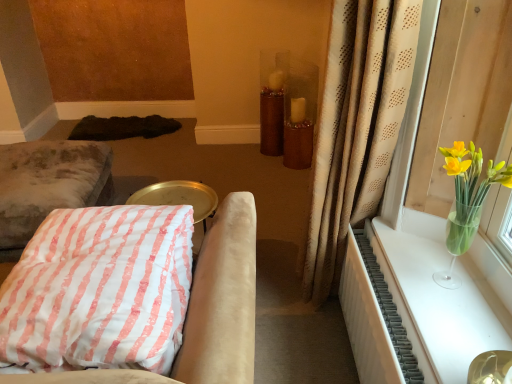
Question: Is white textured radiator at right bigger or smaller than brown glittery vase at center?

Choices:
 (A) small
 (B) big

Answer: (A)

Question: Is point (352, 269) positioned closer to the camera than point (273, 114)?

Choices:
 (A) closer
 (B) farther

Answer: (A)

Question: Which of these objects is positioned farthest from the translucent glass vase at upper right?

Choices:
 (A) velvet cushion at left, acting as the first furniture starting from the back
 (B) dark brown shaggy rug at lower left
 (C) beige dotted curtain at right
 (D) brown glittery vase at center
 (E) pink striped fabric cushion at lower left, which is counted as the second furniture, starting from the back

Answer: (B)

Question: Which is farther from the pink striped fabric cushion at lower left, the first furniture in the front-to-back sequence?

Choices:
 (A) dark brown shaggy rug at lower left
 (B) white textured radiator at right
 (C) velvet cushion at left, placed as the first furniture when sorted from left to right
 (D) translucent glass vase at upper right
 (E) brown glittery vase at center

Answer: (A)